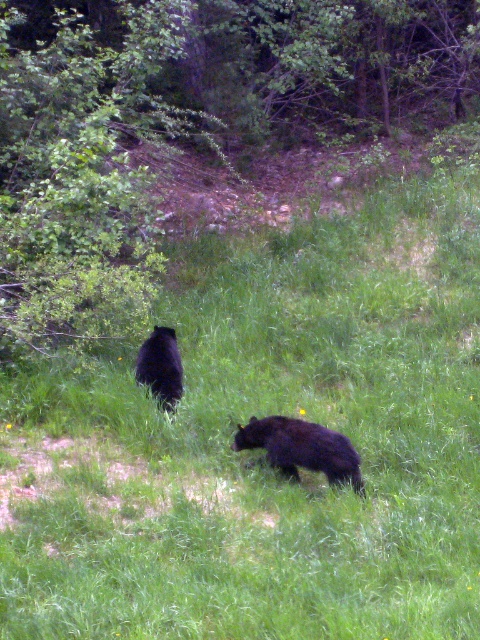
Locate an element on the screen. Image resolution: width=480 pixels, height=640 pixels. green leafy tree at upper left is located at coordinates (187, 116).

Locate an element on the screen. The width and height of the screenshot is (480, 640). green leafy tree at upper left is located at coordinates pyautogui.click(x=187, y=116).

Measure the distance between green leafy tree at upper left and camera.

They are 24.38 feet apart.

This screenshot has width=480, height=640. What do you see at coordinates (187, 116) in the screenshot?
I see `green leafy tree at upper left` at bounding box center [187, 116].

Where is `green leafy tree at upper left`? The height and width of the screenshot is (640, 480). green leafy tree at upper left is located at coordinates (187, 116).

Which is below, black furry bear at lower center or black fuzzy bear at center?

black furry bear at lower center

Is point (290, 440) more distant than point (168, 385)?

No.

Locate an element on the screen. Image resolution: width=480 pixels, height=640 pixels. black furry bear at lower center is located at coordinates (301, 449).